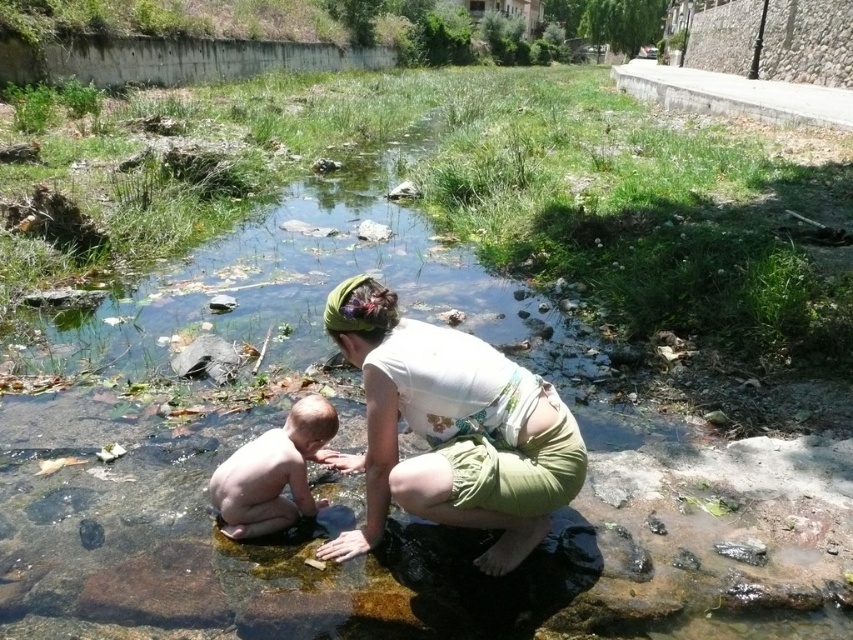
Is white fabric at center taller than smooth skin baby at center?

Yes, white fabric at center is taller than smooth skin baby at center.

Does white fabric at center appear under smooth skin baby at center?

Actually, white fabric at center is above smooth skin baby at center.

Between point (502, 406) and point (312, 458), which one is positioned in front?

Point (502, 406) is in front.

Identify the location of white fabric at center. The height and width of the screenshot is (640, 853). (451, 429).